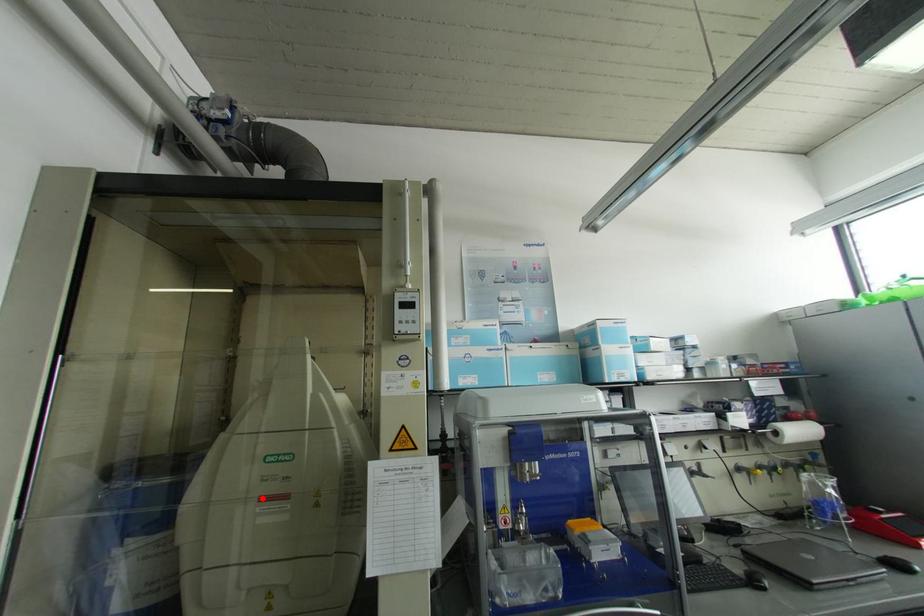
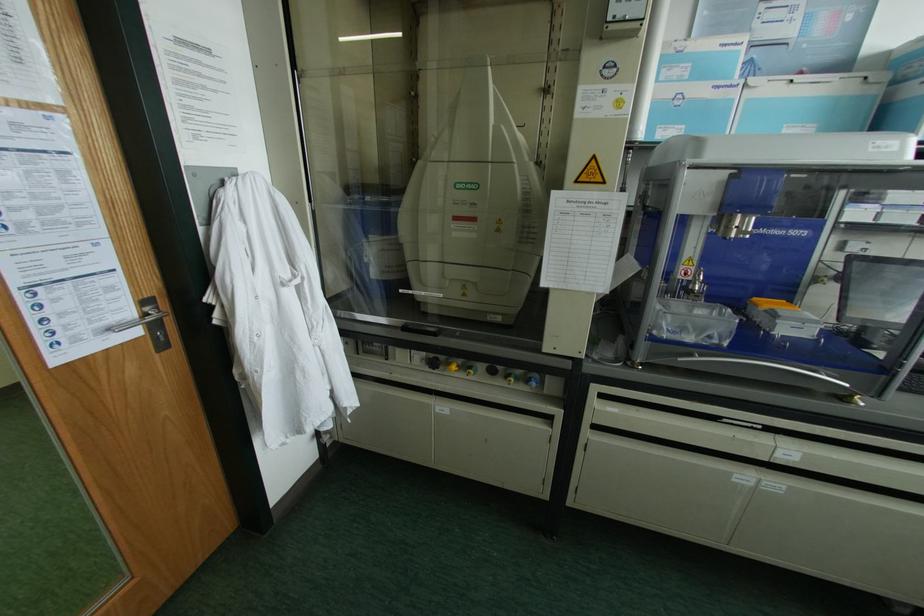
Where in the second image is the point corresponding to the highlighted location from the first image?

(455, 217)